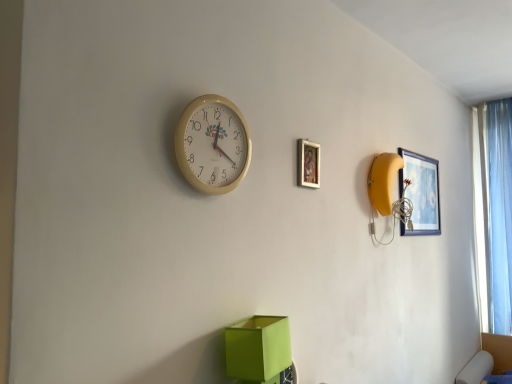
Question: Looking at the image, does wooden picture frame at upper center, marked as the 1th picture frame in a front-to-back arrangement, seem bigger or smaller compared to beige plastic wall clock at upper center?

Choices:
 (A) big
 (B) small

Answer: (B)

Question: Would you say wooden picture frame at upper center, marked as the 1th picture frame in a front-to-back arrangement, is inside or outside beige plastic wall clock at upper center?

Choices:
 (A) inside
 (B) outside

Answer: (B)

Question: Which is farther from the matte blue picture frame at upper right, the 2th picture frame from the left?

Choices:
 (A) light blue sheer curtain at right
 (B) wooden picture frame at upper center, marked as the 1th picture frame in a left-to-right arrangement
 (C) green cardboard box at lower center
 (D) beige plastic wall clock at upper center

Answer: (D)

Question: Estimate the real-world distances between objects in this image. Which object is closer to the wooden picture frame at upper center, the 2th picture frame positioned from the right?

Choices:
 (A) matte blue picture frame at upper right, which is the 1th picture frame in back-to-front order
 (B) beige plastic wall clock at upper center
 (C) green cardboard box at lower center
 (D) light blue sheer curtain at right

Answer: (B)